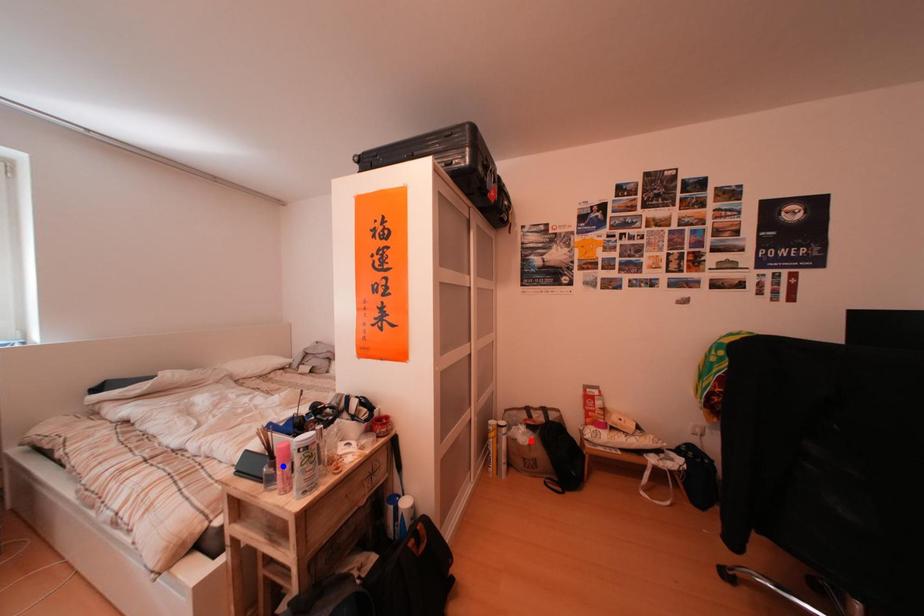
Question: Two points are marked on the image. Which point is closer to the camera?

Choices:
 (A) Blue point is closer.
 (B) Red point is closer.

Answer: (A)